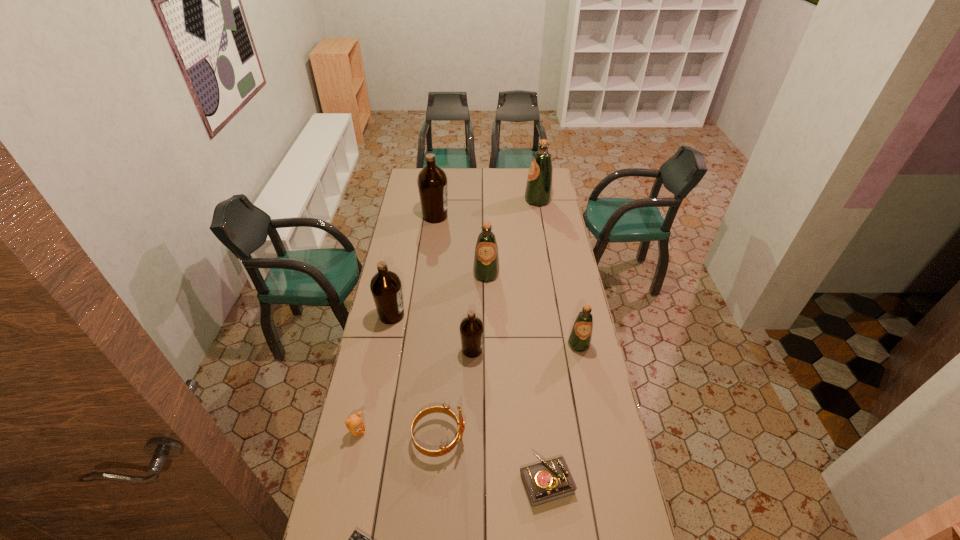
This screenshot has height=540, width=960. I want to click on blank area in the image that satisfies the following two spatial constraints: 1. on the face of the ninth tallest object; 2. on the left side of the brown teddy bear, so click(347, 482).

This screenshot has height=540, width=960. What are the coordinates of `free space that satisfies the following two spatial constraints: 1. on the front-facing side of the smallest green olive oil; 2. on the label of the smallest brown olive oil` in the screenshot? It's located at (580, 350).